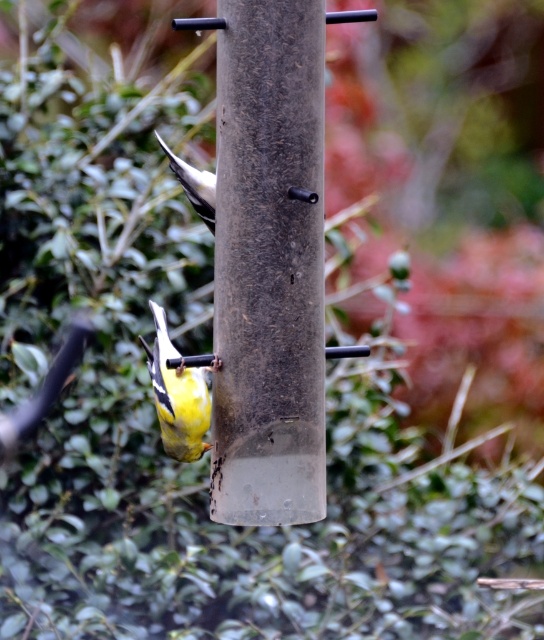
Question: Does smooth brown pole at center appear under yellow matte bird at center?

Choices:
 (A) yes
 (B) no

Answer: (B)

Question: Which of the following is the closest to the observer?

Choices:
 (A) yellow and black feathers at center
 (B) smooth brown pole at center

Answer: (B)

Question: Does yellow matte bird at center appear on the right side of yellow and black feathers at center?

Choices:
 (A) yes
 (B) no

Answer: (B)

Question: Among these points, which one is farthest from the camera?

Choices:
 (A) (211, 195)
 (B) (194, 460)

Answer: (A)

Question: Is smooth brown pole at center bigger than yellow and black feathers at center?

Choices:
 (A) no
 (B) yes

Answer: (B)

Question: Which point is farther to the camera?

Choices:
 (A) (276, 268)
 (B) (174, 436)

Answer: (B)